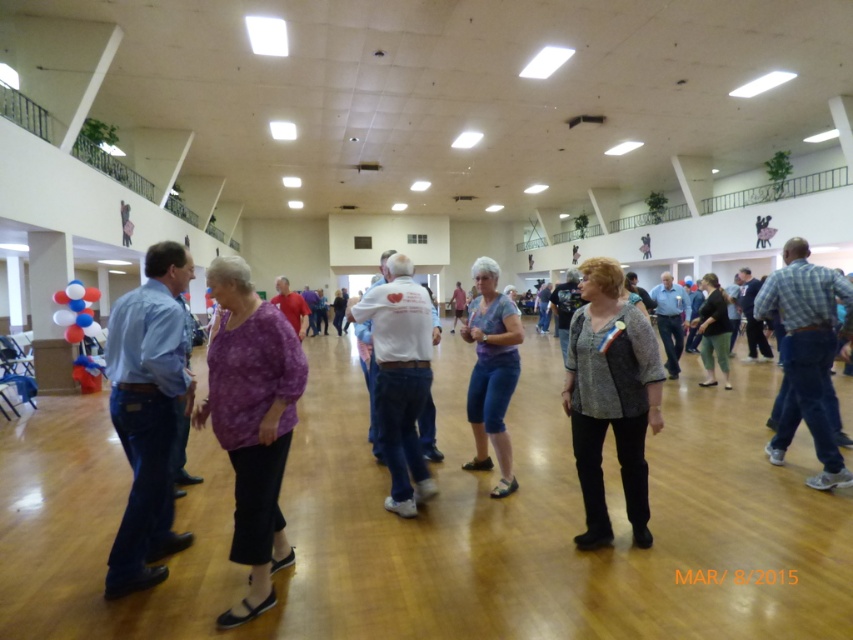
Question: Does purple fabric blouse at center have a larger size compared to gray textured sweater at center?

Choices:
 (A) no
 (B) yes

Answer: (B)

Question: Among these objects, which one is farthest from the camera?

Choices:
 (A) gray textured sweater at center
 (B) blue denim jeans at left

Answer: (A)

Question: Is white cotton shirt at center closer to the viewer compared to dark gray sweater at center?

Choices:
 (A) yes
 (B) no

Answer: (A)

Question: Is blue plaid shirt at right wider than dark gray sweater at center?

Choices:
 (A) no
 (B) yes

Answer: (A)

Question: Based on their relative distances, which object is farther from the blue denim shorts at center?

Choices:
 (A) gray textured sweater at center
 (B) purple fabric blouse at center
 (C) blue plaid shirt at right
 (D) dark gray sweater at center

Answer: (D)

Question: Which of these objects is positioned farthest from the blue plaid shirt at right?

Choices:
 (A) white cotton shirt at center
 (B) gray textured sweater at center
 (C) purple fabric blouse at center

Answer: (C)